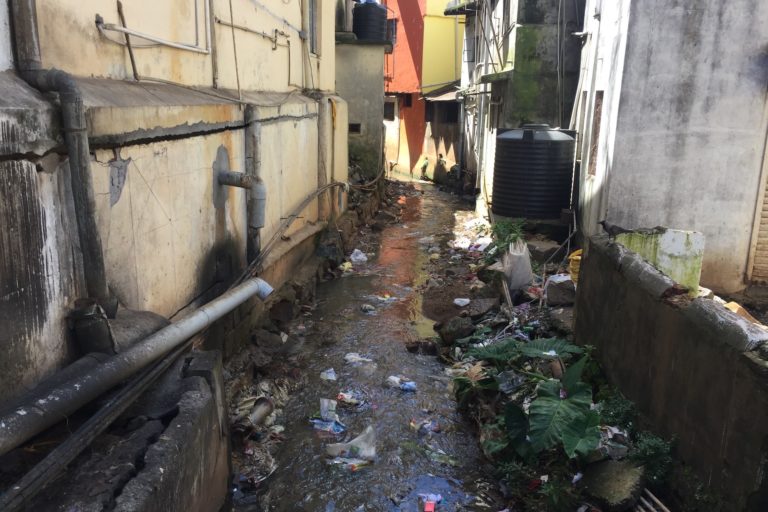
The height and width of the screenshot is (512, 768). Identify the location of red wall. pyautogui.click(x=409, y=62).